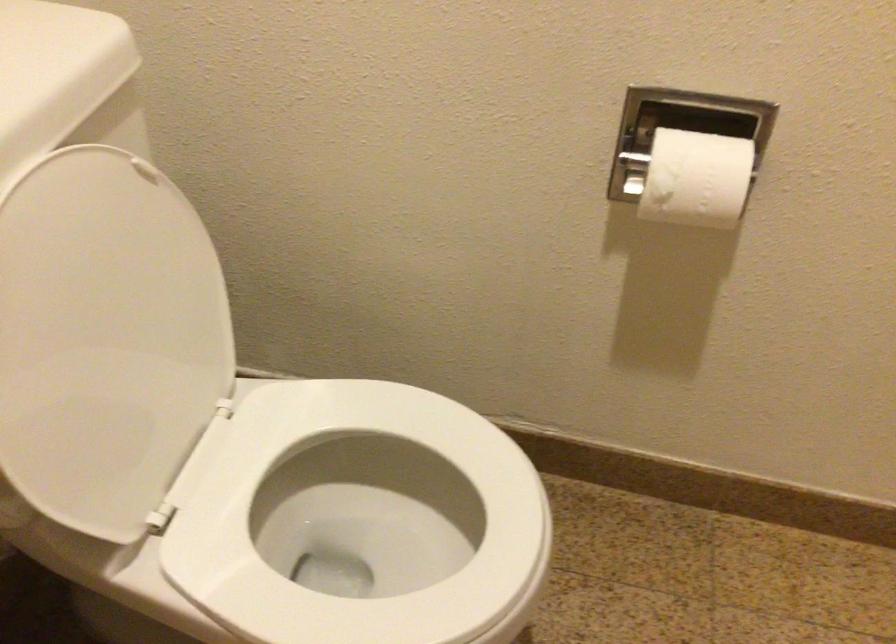
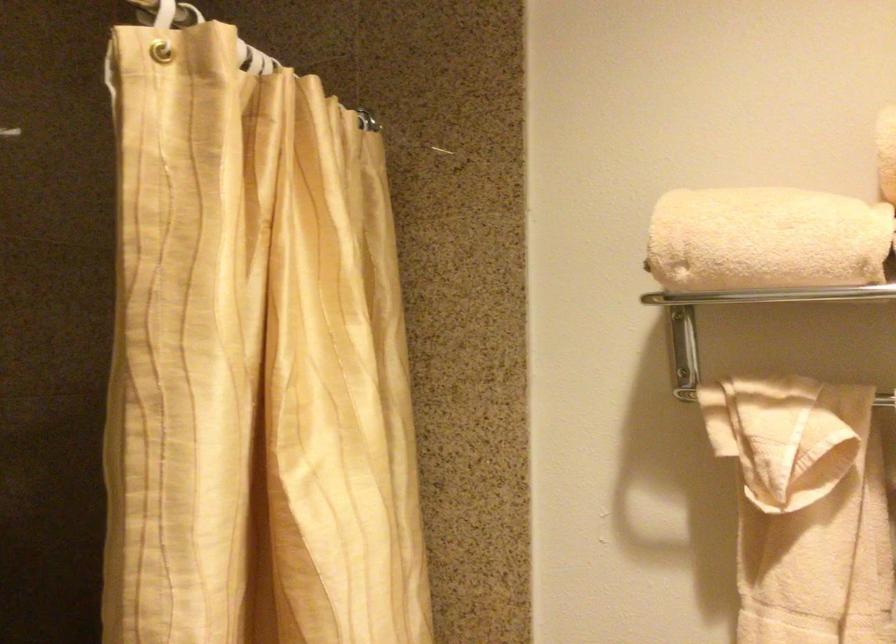
Question: The first image is from the beginning of the video and the second image is from the end. How did the camera likely rotate when shooting the video?

Choices:
 (A) Left
 (B) Right
 (C) Up
 (D) Down

Answer: (A)